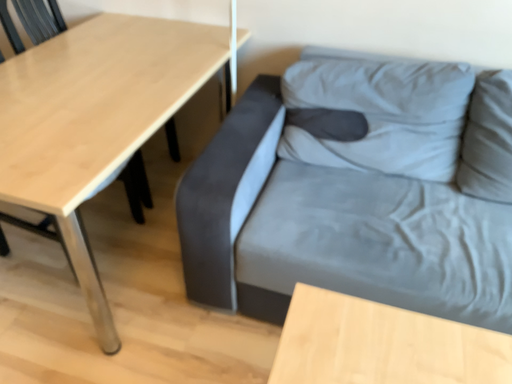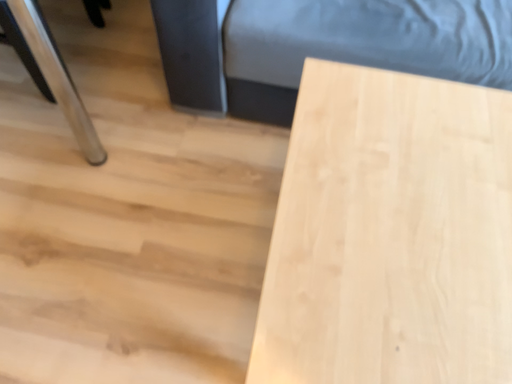
Question: How did the camera likely rotate when shooting the video?

Choices:
 (A) rotated upward
 (B) rotated downward

Answer: (B)